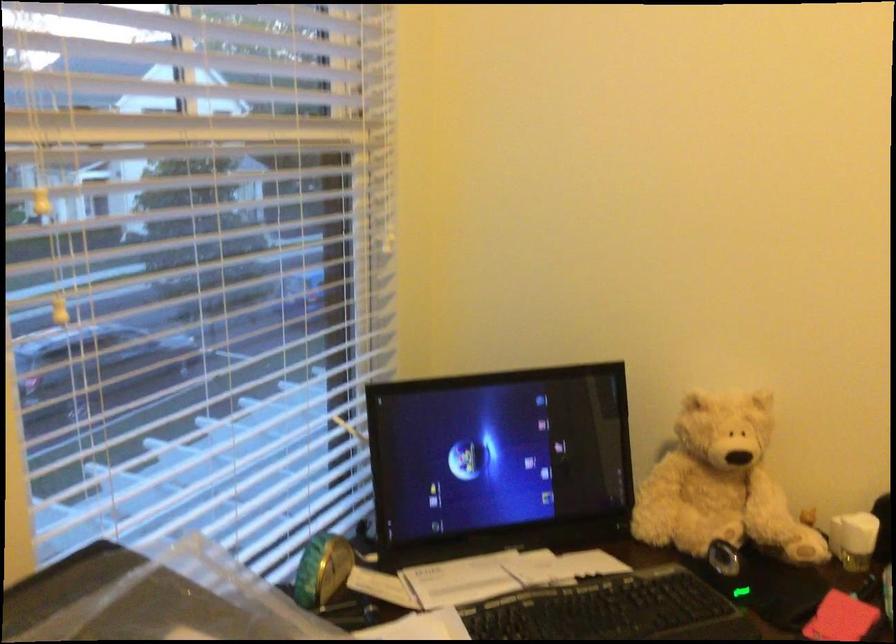
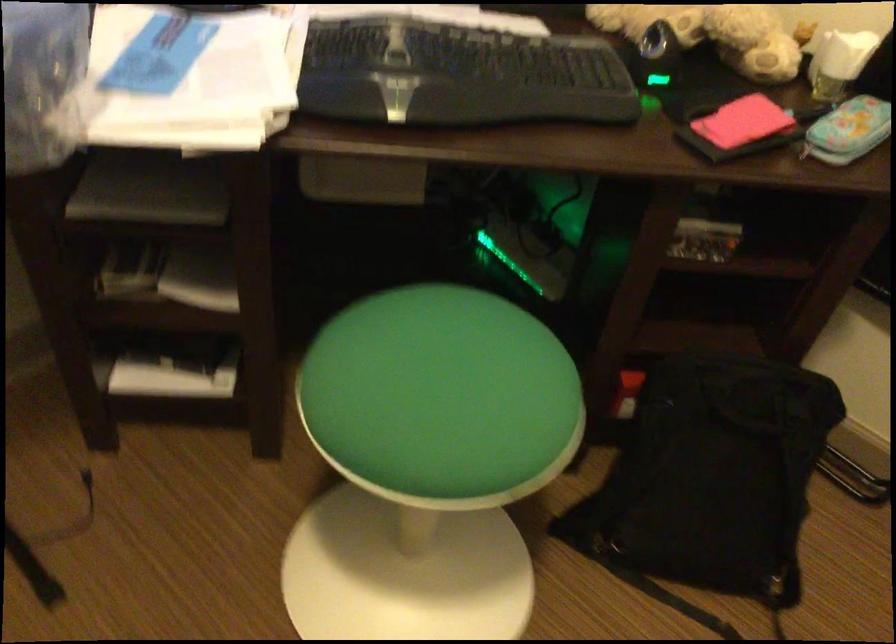
Question: The images are taken continuously from a first-person perspective. In which direction is your viewpoint rotating?

Choices:
 (A) Left
 (B) Right
 (C) Up
 (D) Down

Answer: (D)